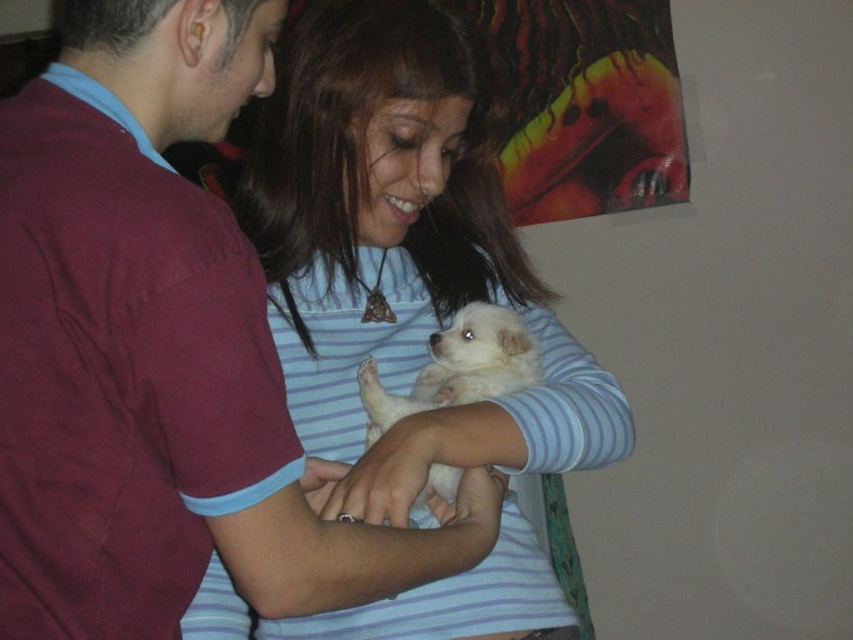
Can you confirm if white soft fur at center is shorter than white fluffy dog at center?

No, white soft fur at center is not shorter than white fluffy dog at center.

Can you confirm if white soft fur at center is positioned to the right of white fluffy dog at center?

Incorrect, white soft fur at center is not on the right side of white fluffy dog at center.

Is point (405, 358) in front of point (439, 397)?

No, (405, 358) is behind (439, 397).

You are a GUI agent. You are given a task and a screenshot of the screen. Output one action in this format:
    pyautogui.click(x=<x>, y=<y>)
    Task: Click on the white soft fur at center
    Image resolution: width=853 pixels, height=640 pixels.
    Given the screenshot: What is the action you would take?
    tap(401, 253)